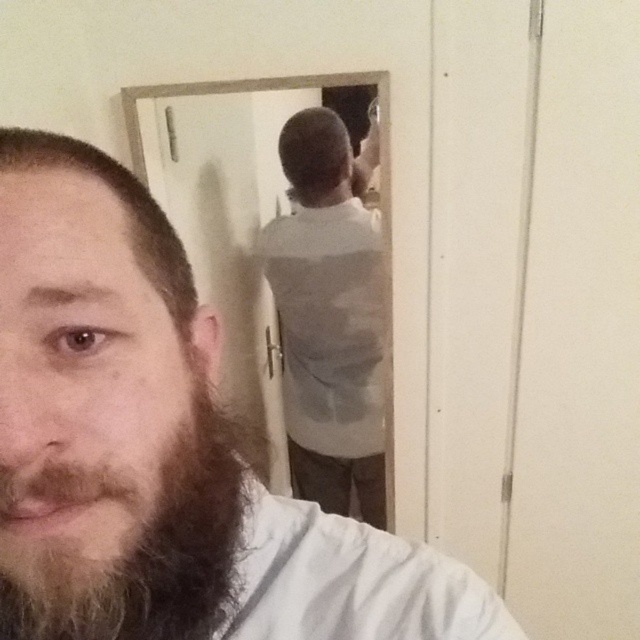
Is white matte shirt at center wider than dark brown curly beard at left?

Yes.

Who is more distant from viewer, (321,150) or (228,460)?

Positioned behind is point (321,150).

Where is `white matte shirt at center`? white matte shirt at center is located at coordinates (330, 316).

Does white matte shirt at center appear under brown matte hair at left?

Indeed, white matte shirt at center is positioned under brown matte hair at left.

Between point (374, 444) and point (176, 282), which one is positioned in front?

Point (176, 282)

Where is `white matte shirt at center`? white matte shirt at center is located at coordinates (330, 316).

Which is more to the right, light brown hair at left or white matte shirt at center?

Positioned to the right is white matte shirt at center.

Is light brown hair at left smaller than white matte shirt at center?

Yes.

Who is more distant from viewer, (x=179, y=371) or (x=332, y=337)?

The point (x=332, y=337) is behind.

The height and width of the screenshot is (640, 640). In order to click on light brown hair at left in this screenshot , I will do coord(161,449).